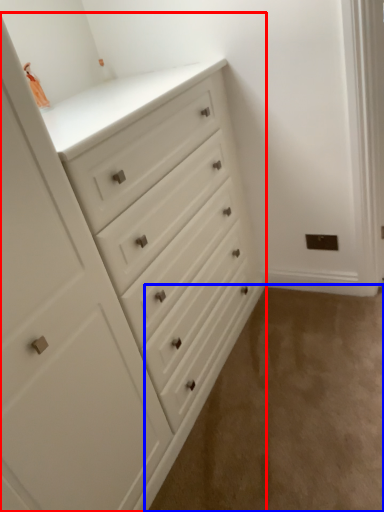
Question: Among these objects, which one is nearest to the camera, chest of drawers (highlighted by a red box) or corridor (highlighted by a blue box)?

Choices:
 (A) chest of drawers
 (B) corridor

Answer: (A)